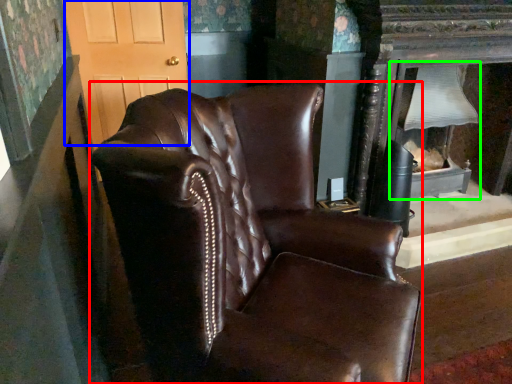
Question: Estimate the real-world distances between objects in this image. Which object is farther from chair (highlighted by a red box), glass door (highlighted by a blue box) or fireplace (highlighted by a green box)?

Choices:
 (A) glass door
 (B) fireplace

Answer: (A)